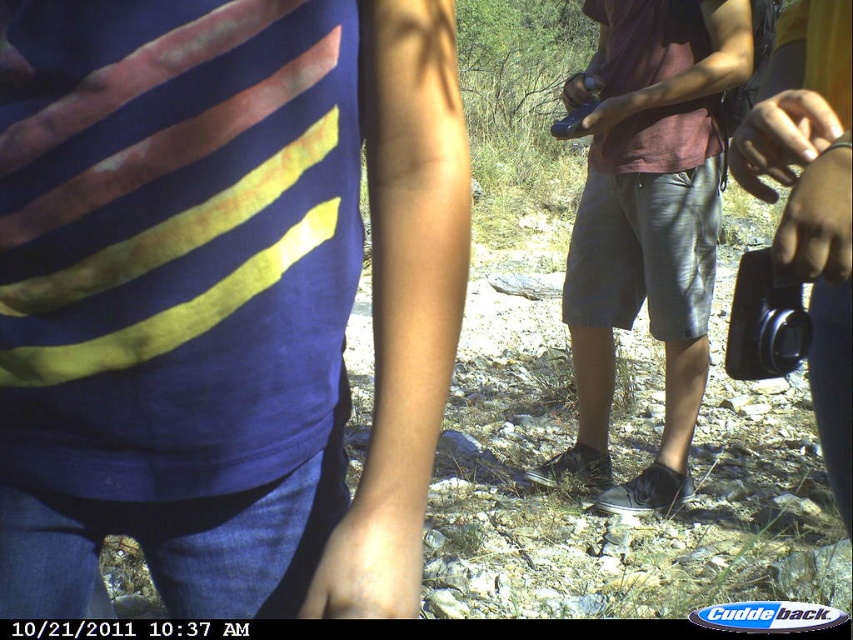
You are a photographer trying to capture a candid shot of the dark gray denim shorts at center and the black plastic camera at right. Since you want to focus on both objects, which one should you adjust your camera to prioritize in terms of focus depth?

The dark gray denim shorts at center is located above the black plastic camera at right, so you should prioritize focusing on the dark gray denim shorts at center to ensure both are in focus.

You are trying to determine the clothing items worn by two people in the scene. Given that the blue matte shirt at center and dark gray denim shorts at center are visible, which clothing item appears smaller in size?

The blue matte shirt at center has a smaller size compared to the dark gray denim shorts at center.

You are a photographer trying to capture a candid shot of the dark gray denim shorts at center and the black plastic camera at right. Since you want to ensure both are in focus, which object should you place your focus point closer to?

The dark gray denim shorts at center is taller than the black plastic camera at right, so you should focus on the dark gray denim shorts at center because it is larger and requires more precise focus to ensure both are in focus.